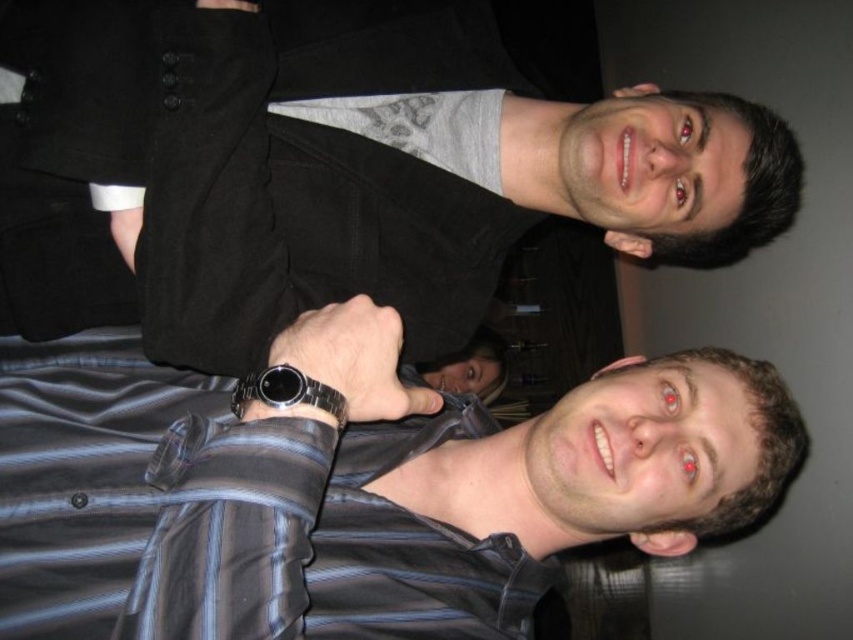
From the picture: You are trying to locate the black matte shirt at upper center and the sleek metal watch at center in the image. Which object is positioned to the right of the other?

The black matte shirt at upper center is to the right of the sleek metal watch at center.

You are a photographer setting up for a group photo. You notice the black matte shirt at upper center and the sleek metal watch at center. Which object should you focus on first if you want to capture both in sharp focus?

The black matte shirt at upper center is much taller than the sleek metal watch at center, so focusing on the black matte shirt at upper center first would ensure both are in sharp focus as it is the larger subject.